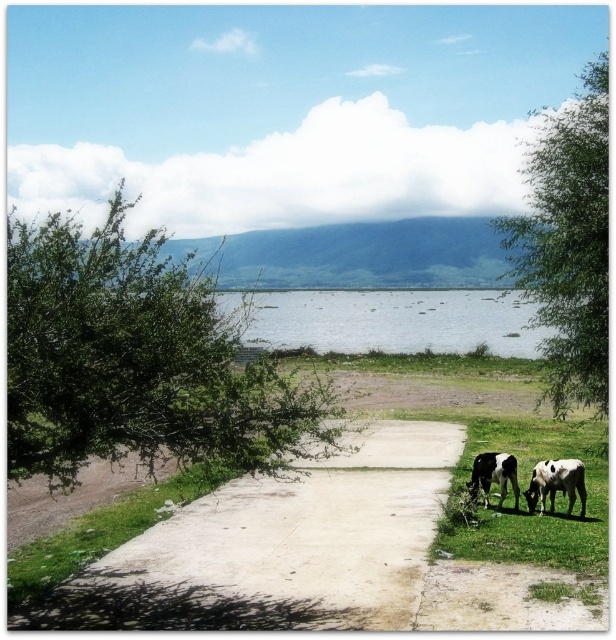
Question: Is white concrete pavement at center closer to camera compared to black and white cow at lower right?

Choices:
 (A) yes
 (B) no

Answer: (A)

Question: Can you confirm if green leafy tree at left is positioned above black and white cow at lower right?

Choices:
 (A) yes
 (B) no

Answer: (A)

Question: Among these objects, which one is nearest to the camera?

Choices:
 (A) white concrete pavement at center
 (B) green grass at lower right
 (C) green leafy tree at right

Answer: (A)

Question: Can you confirm if green leafy tree at right is smaller than black and white cow at lower right?

Choices:
 (A) yes
 (B) no

Answer: (B)

Question: Estimate the real-world distances between objects in this image. Which object is farther from the green grass at lower right?

Choices:
 (A) black and white spotted cow at lower right
 (B) black and white cow at lower right
 (C) green leafy tree at right

Answer: (C)

Question: Based on their relative distances, which object is farther from the black and white cow at lower right?

Choices:
 (A) black and white spotted cow at lower right
 (B) green grass at lower right
 (C) green leafy tree at left
 (D) white concrete pavement at center

Answer: (C)